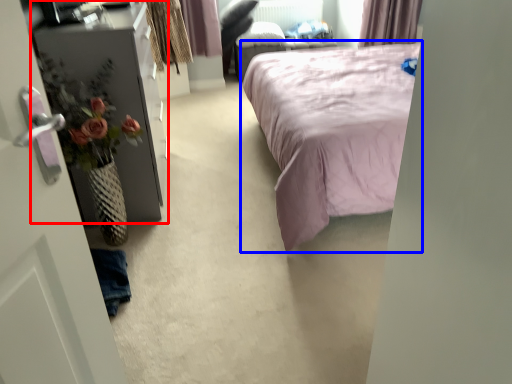
Question: Which object is further to the camera taking this photo, furniture (highlighted by a red box) or bed (highlighted by a blue box)?

Choices:
 (A) furniture
 (B) bed

Answer: (A)